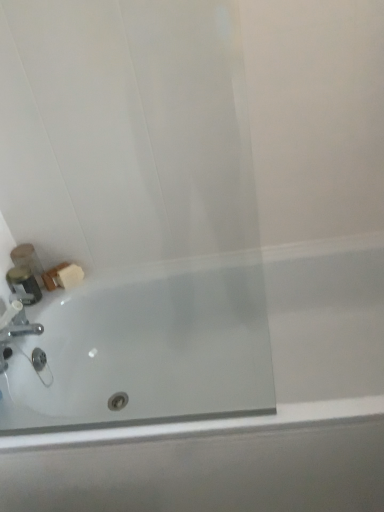
Identify the location of unoccupied region to the right of metallic silver container at left, the second toiletry positioned from the back. (60, 288).